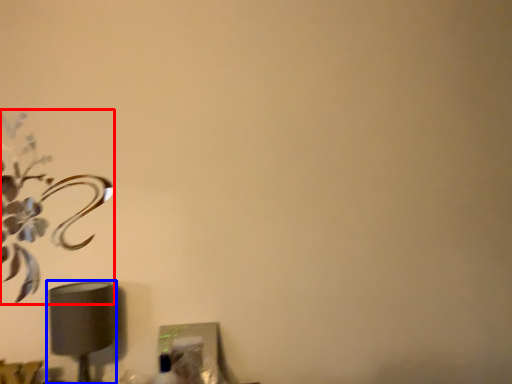
Question: Among these objects, which one is nearest to the camera, flower (highlighted by a red box) or lamp (highlighted by a blue box)?

Choices:
 (A) flower
 (B) lamp

Answer: (B)